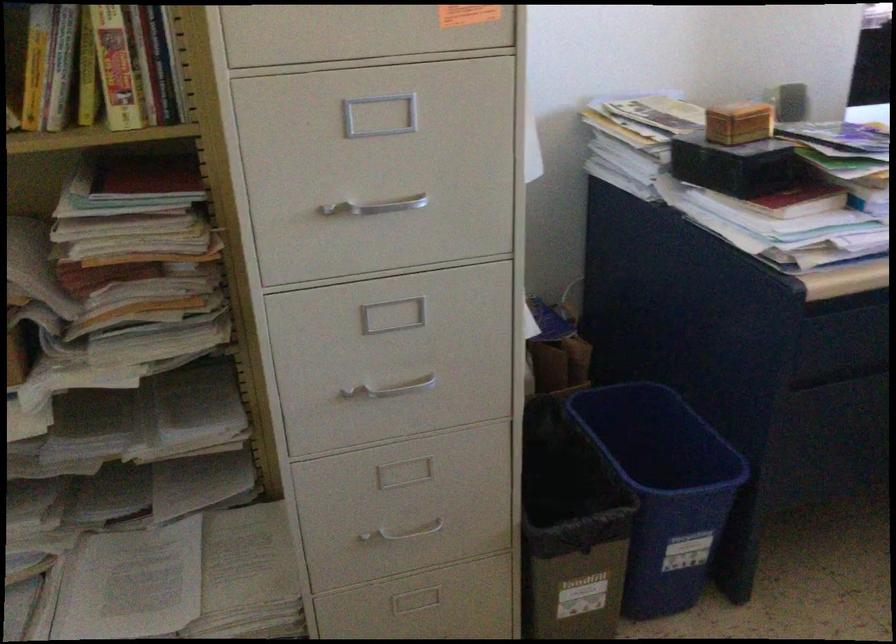
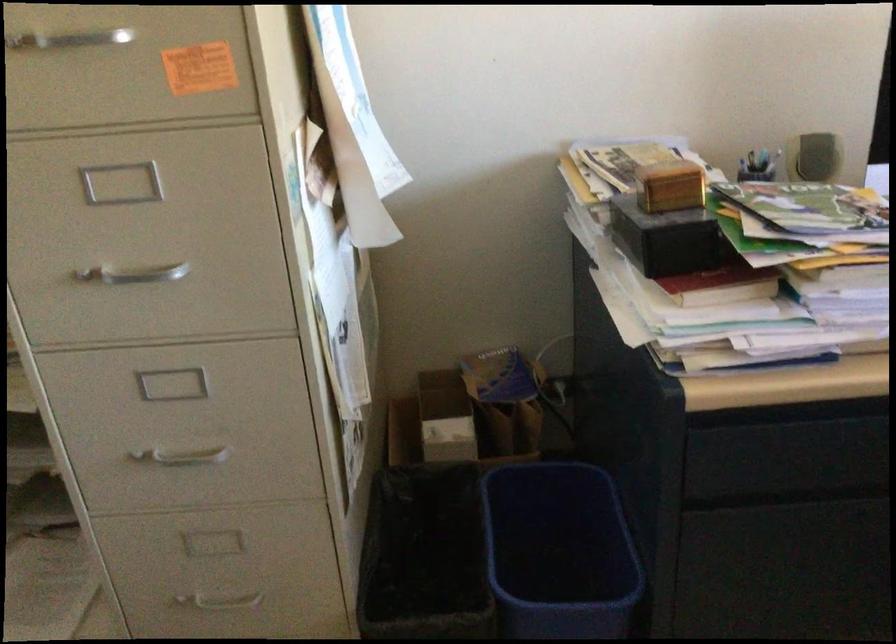
In the second image, find the point that corresponds to (x=399, y=529) in the first image.

(216, 601)